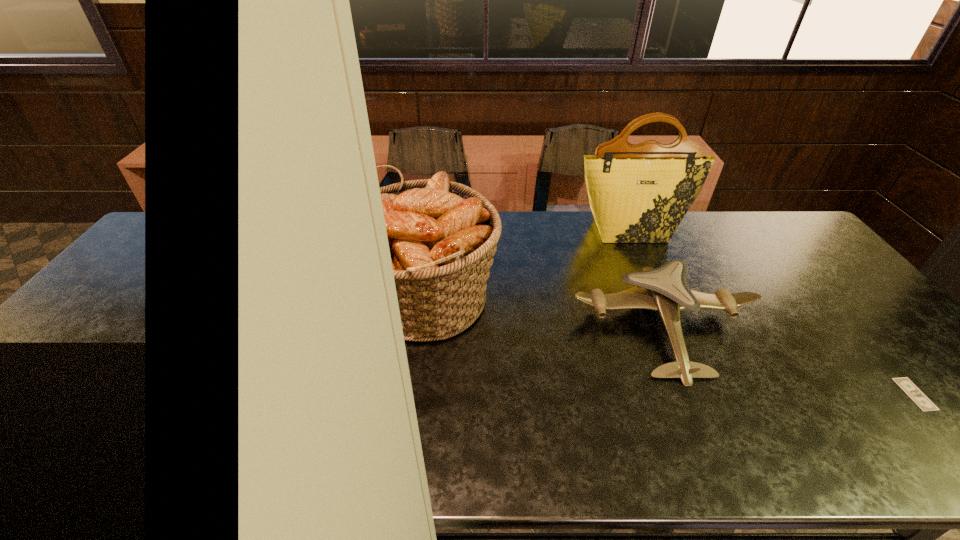
What are the coordinates of `vacant space that's between the drone and the basket` in the screenshot? It's located at (543, 314).

Locate an element on the screen. vacant area between the drone and the shortest object is located at coordinates (789, 360).

Identify the location of vacant area between the farthest object and the basket. This screenshot has width=960, height=540. (527, 266).

This screenshot has height=540, width=960. In order to click on free area in between the shortest object and the farthest object in this screenshot , I will do `click(773, 312)`.

Where is `object that stands as the third closest to the shortest object`? The image size is (960, 540). object that stands as the third closest to the shortest object is located at coordinates (442, 235).

Locate an element on the screen. The image size is (960, 540). object that can be found as the second closest to the basket is located at coordinates (639, 193).

I want to click on vacant region that satisfies the following two spatial constraints: 1. on the front-facing side of the rightmost object; 2. on the right side of the drone, so click(691, 394).